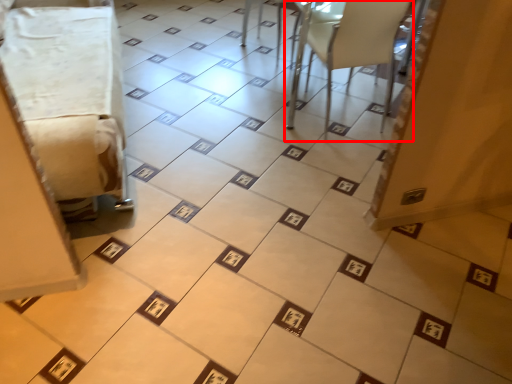
Question: Considering the relative positions of furniture (annotated by the red box) and furniture in the image provided, where is furniture (annotated by the red box) located with respect to the staircase?

Choices:
 (A) left
 (B) right

Answer: (B)